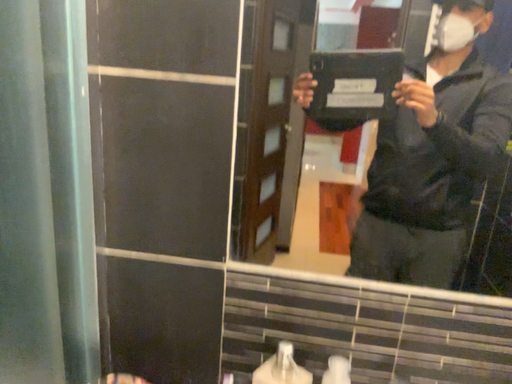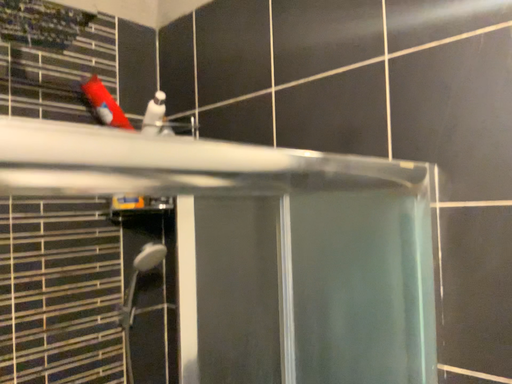
Question: How did the camera likely rotate when shooting the video?

Choices:
 (A) rotated left
 (B) rotated right

Answer: (A)